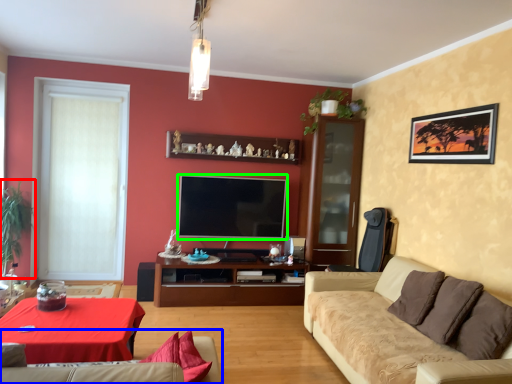
Question: Based on their relative distances, which object is farther from plant (highlighted by a red box)? Choose from studio couch (highlighted by a blue box) and television (highlighted by a green box).

Choices:
 (A) studio couch
 (B) television

Answer: (A)